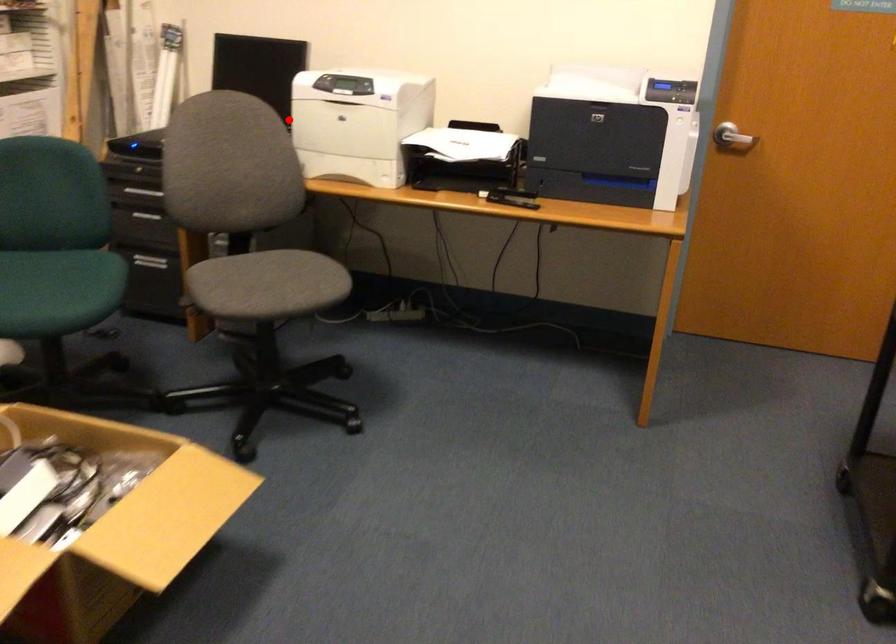
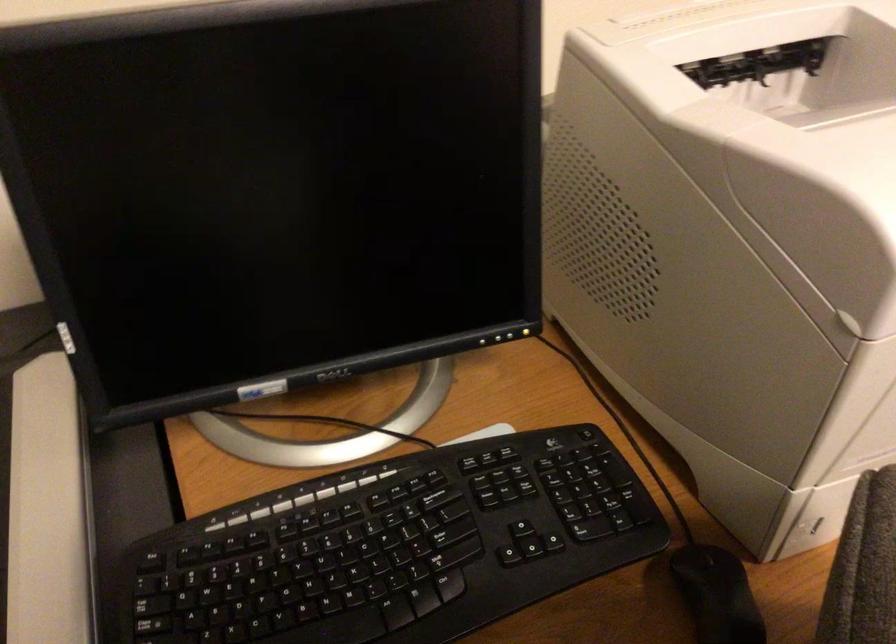
Question: I am providing you with two images of the same scene from different viewpoints. In image1, a red point is highlighted. Considering the same 3D point in image2, which of the following is correct?

Choices:
 (A) It is closer
 (B) It is farther

Answer: (A)